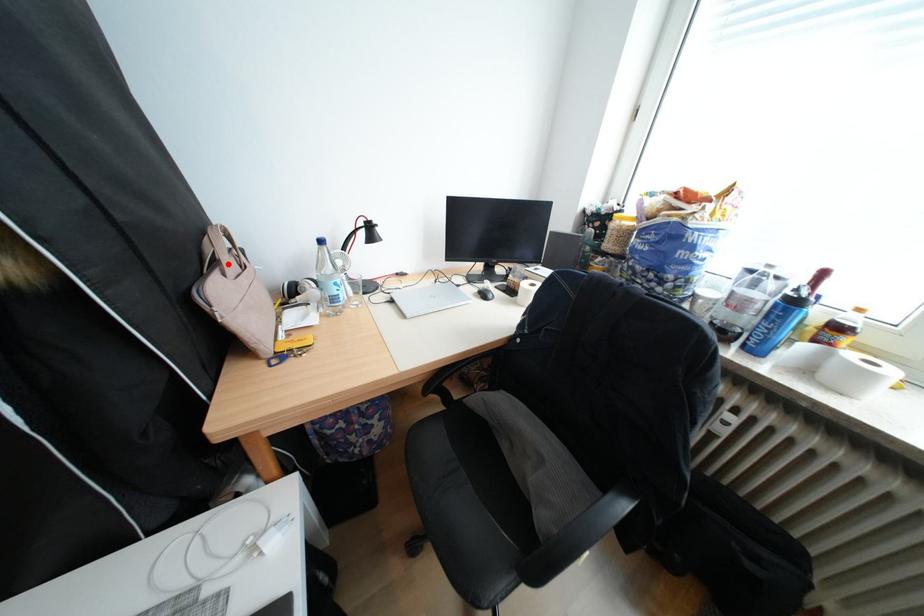
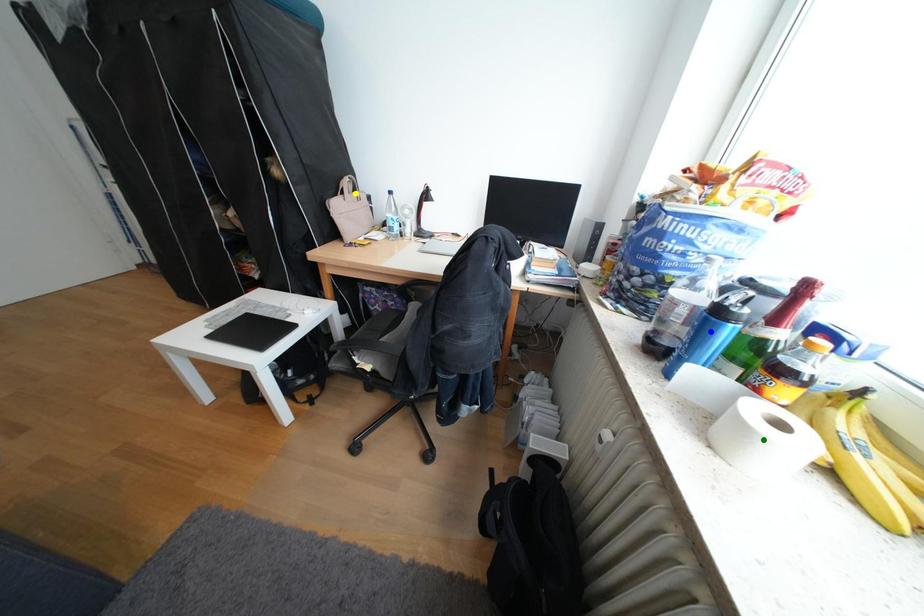
Question: I am providing you with two images of the same scene from different viewpoints. A red point is marked on the first image. You are given multiple points on the second image. Which spot in image 2 lines up with the point in image 1?

Choices:
 (A) blue point
 (B) yellow point
 (C) green point

Answer: (B)